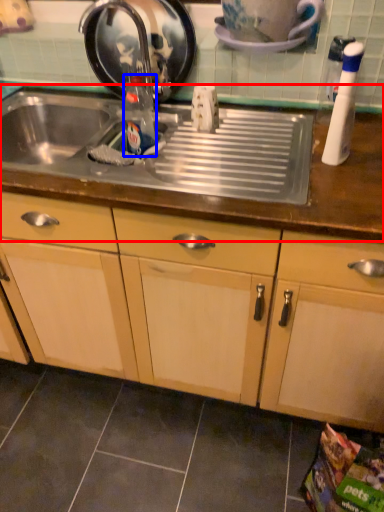
Question: Which point is closer to the camera, countertop (highlighted by a red box) or bottle (highlighted by a blue box)?

Choices:
 (A) countertop
 (B) bottle

Answer: (A)